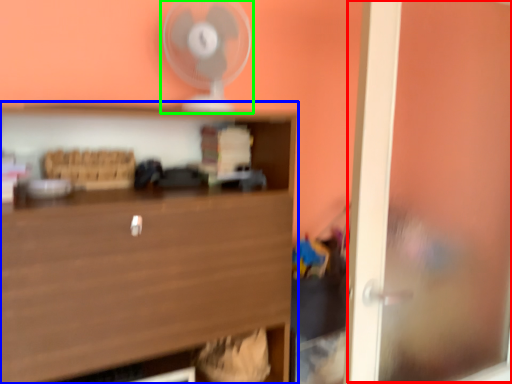
Question: Which is farther away from window (highlighted by a red box)? shelf (highlighted by a blue box) or fan (highlighted by a green box)?

Choices:
 (A) shelf
 (B) fan

Answer: (B)